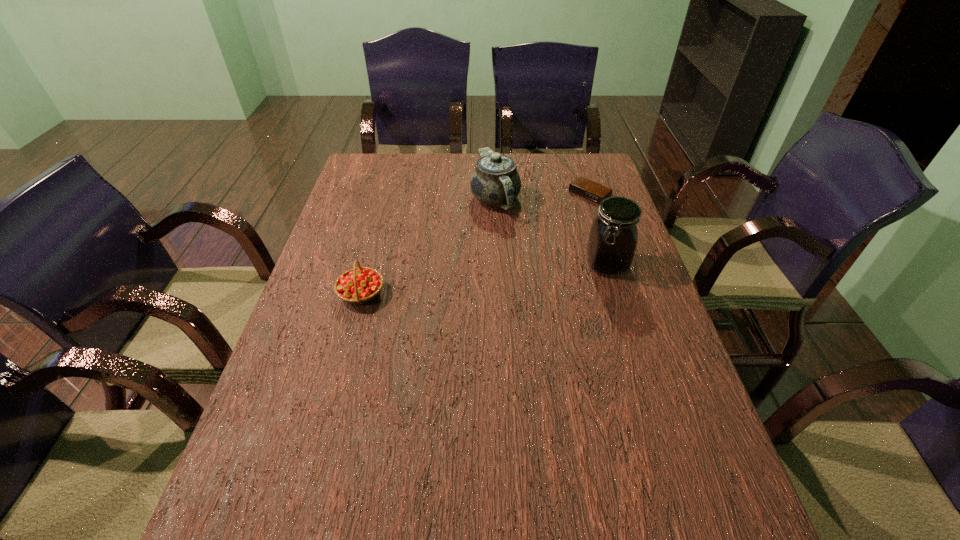
The image size is (960, 540). In the image, there is a desktop. What are the coordinates of `vacant space at the far edge` in the screenshot? It's located at (428, 165).

This screenshot has height=540, width=960. I want to click on vacant space at the near edge of the desktop, so click(610, 476).

In the image, there is a desktop. In order to click on vacant space at the left edge in this screenshot , I will do click(x=264, y=396).

The image size is (960, 540). In the image, there is a desktop. In order to click on vacant space at the right edge in this screenshot , I will do `click(674, 395)`.

Identify the location of vacant space at the far right corner of the desktop. (561, 156).

Identify the location of vacant point located between the leftmost object and the chinaware. (428, 247).

What are the coordinates of `free space between the second tallest object and the jar` in the screenshot? It's located at (551, 232).

This screenshot has height=540, width=960. I want to click on vacant area that lies between the chinaware and the shortest object, so click(x=542, y=197).

Identify the location of free space between the alarm clock and the third tallest object. This screenshot has width=960, height=540. (475, 244).

This screenshot has width=960, height=540. Find the location of `vacant region between the strawberry and the jar`. vacant region between the strawberry and the jar is located at coordinates [x=484, y=279].